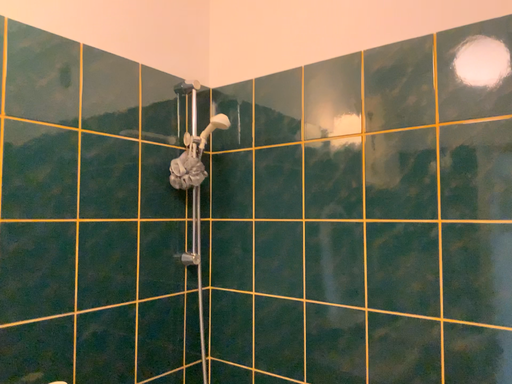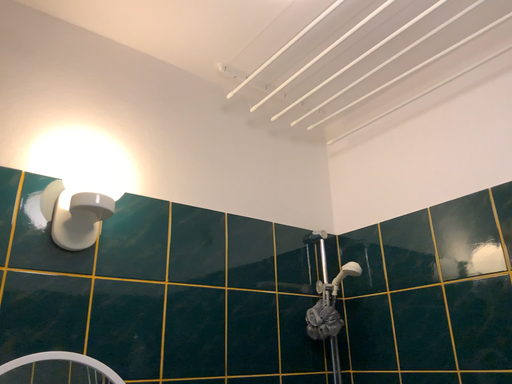
Question: How did the camera likely rotate when shooting the video?

Choices:
 (A) rotated right
 (B) rotated left

Answer: (B)